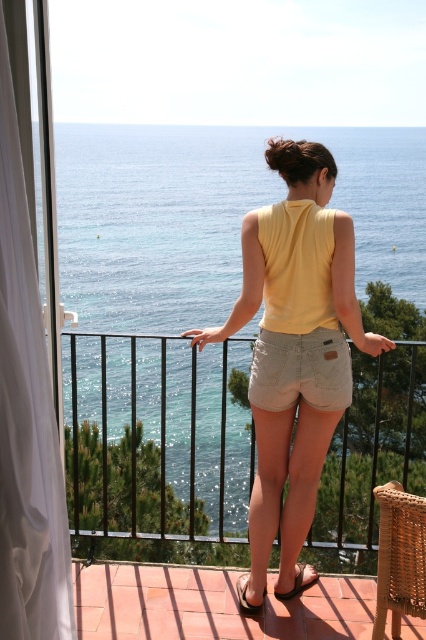
You are standing on the balcony looking at the brown leather sandal at lower center and the black leather sandal at lower center. Which sandal is located to the left when viewed from your perspective?

The brown leather sandal at lower center is positioned to the left of the black leather sandal at lower center from your viewpoint.

You are standing on the balcony and want to put on your sandals. Which sandal, the brown leather sandal at lower center or the black leather sandal at lower center, is closer to you?

The brown leather sandal at lower center is closer to you because it is in front of the black leather sandal at lower center.